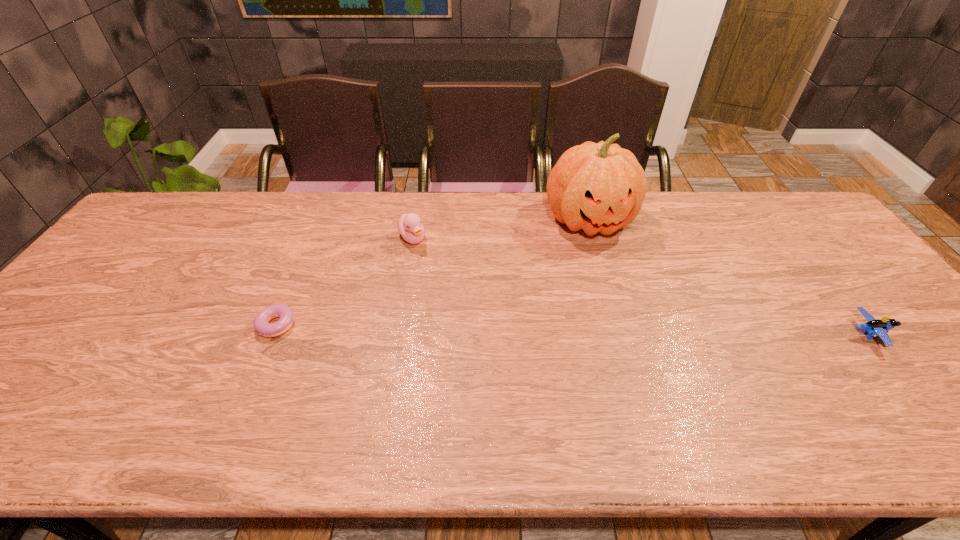
At what (x,y) coordinates should I click in order to perform the action: click on free space that satisfies the following two spatial constraints: 1. on the front side of the tallest object; 2. on the front-facing side of the third tallest object. Please return your answer as a coordinate pair (x, y). Looking at the image, I should click on (621, 334).

Find the location of a particular element. This screenshot has height=540, width=960. free location that satisfies the following two spatial constraints: 1. on the front side of the rightmost object; 2. on the front-facing side of the pumpkin is located at coordinates (621, 334).

The height and width of the screenshot is (540, 960). I want to click on free location that satisfies the following two spatial constraints: 1. on the back side of the third object from right to left; 2. on the right side of the doughnut, so click(316, 239).